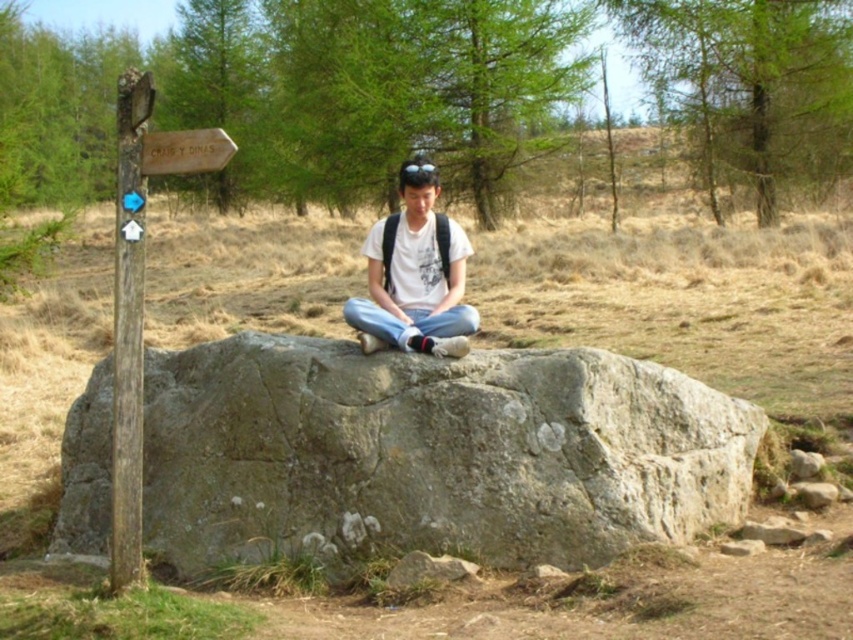
You are a hiker who needs to place a 1.5 meter long rope between the gray rough boulder at center and the wooden post at left. Can you fit the rope between them without bending it?

The distance between the gray rough boulder at center and the wooden post at left is 1.32 meters. Since the rope is 1.5 meters long, it is longer than the distance between them. Therefore, the rope cannot be placed straight between them without bending or coiling it.

You are standing in a forested area and see the gray rough boulder at center and the wooden post at left. Which object is closer to you?

The gray rough boulder at center is closer to you because it is further to the viewer than the wooden post at left.